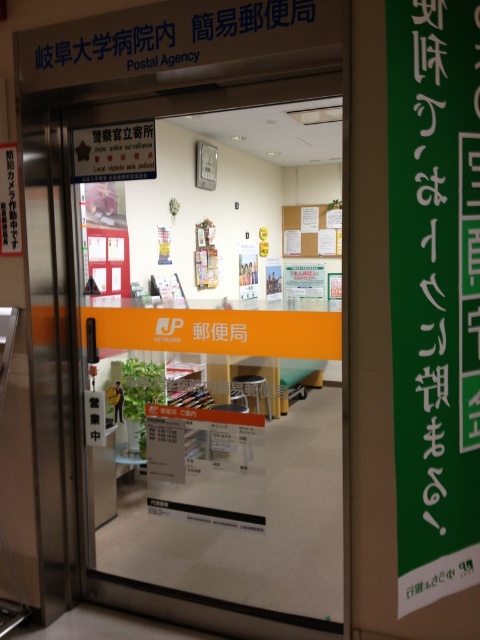
Question: Is transparent glass door at center bigger than green paper at center?

Choices:
 (A) no
 (B) yes

Answer: (B)

Question: Does transparent glass door at center appear on the right side of green paper at center?

Choices:
 (A) no
 (B) yes

Answer: (B)

Question: Which object appears farthest from the camera in this image?

Choices:
 (A) transparent glass door at center
 (B) green paper at center

Answer: (A)

Question: Can you confirm if transparent glass door at center is bigger than green paper at center?

Choices:
 (A) no
 (B) yes

Answer: (B)

Question: Which point is closer to the camera?

Choices:
 (A) green paper at center
 (B) transparent glass door at center

Answer: (A)